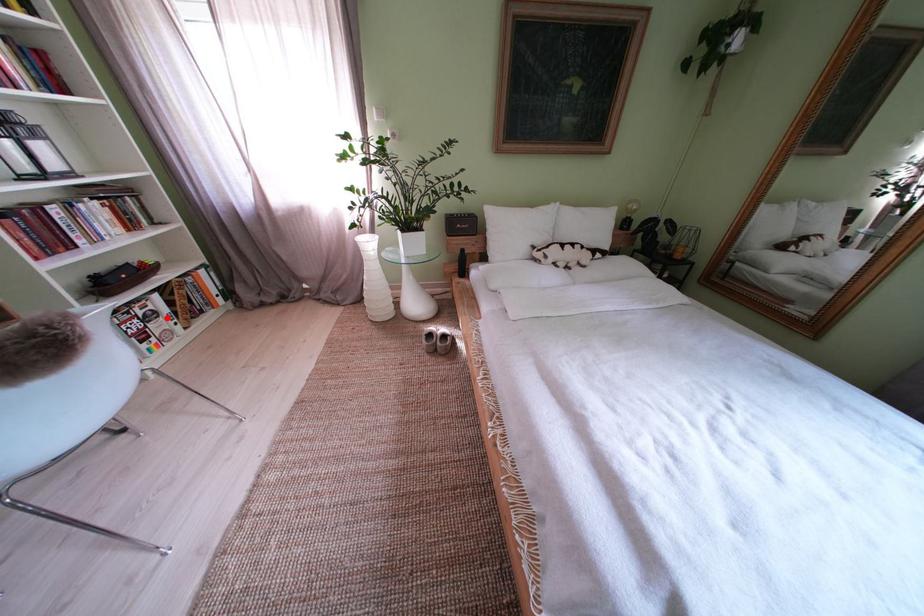
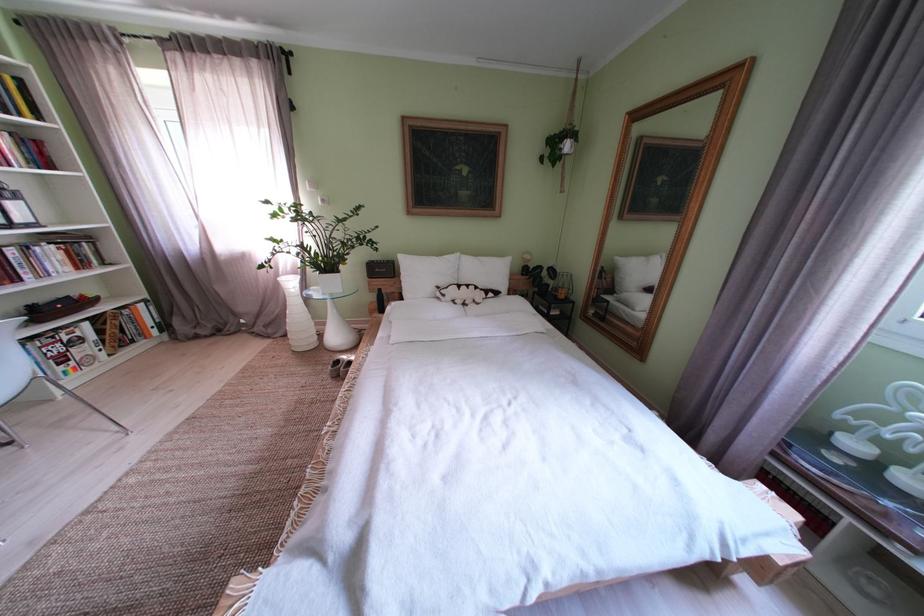
Where in the second image is the point corresponding to the highlighted location from the first image?

(92, 344)